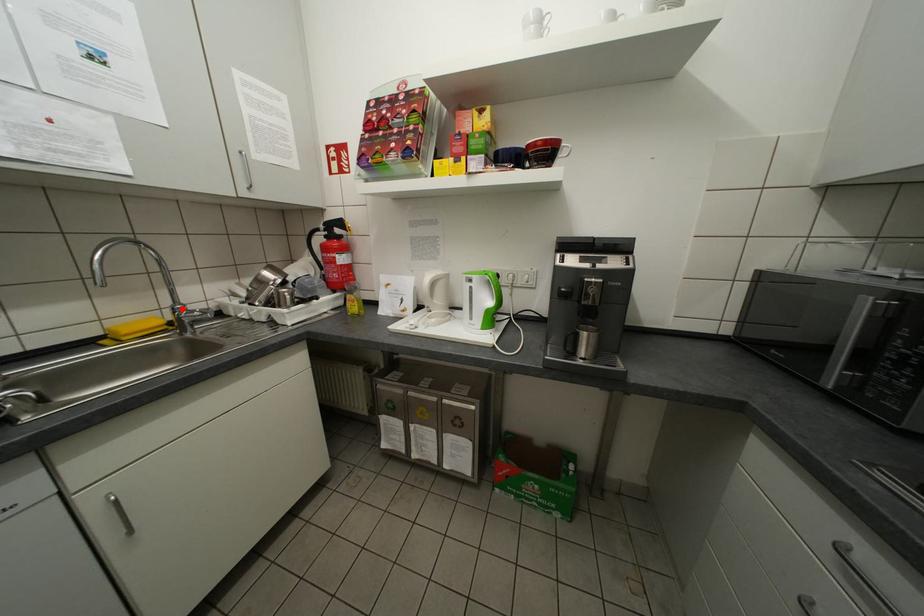
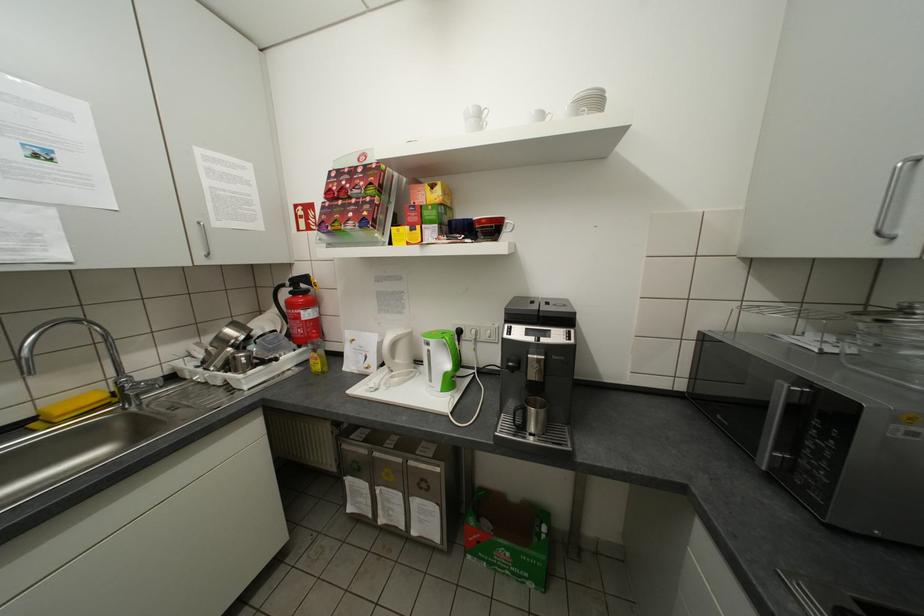
In the second image, find the point that corresponds to the highlighted location in the first image.

(126, 383)